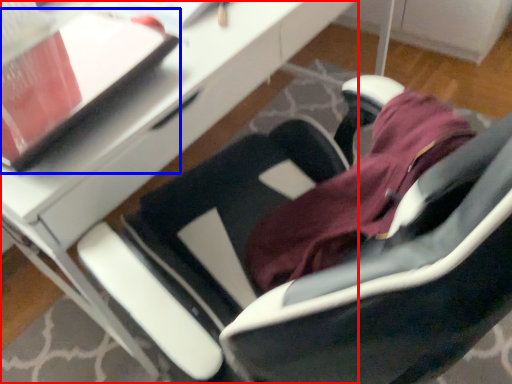
Question: Which of the following is the farthest to the observer, desk (highlighted by a red box) or notepad (highlighted by a blue box)?

Choices:
 (A) desk
 (B) notepad

Answer: (A)